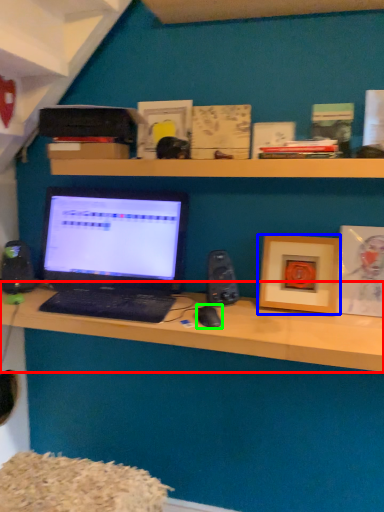
Question: Which object is the farthest from desk (highlighted by a red box)? Choose among these: picture frame (highlighted by a blue box) or mouse (highlighted by a green box).

Choices:
 (A) picture frame
 (B) mouse

Answer: (B)